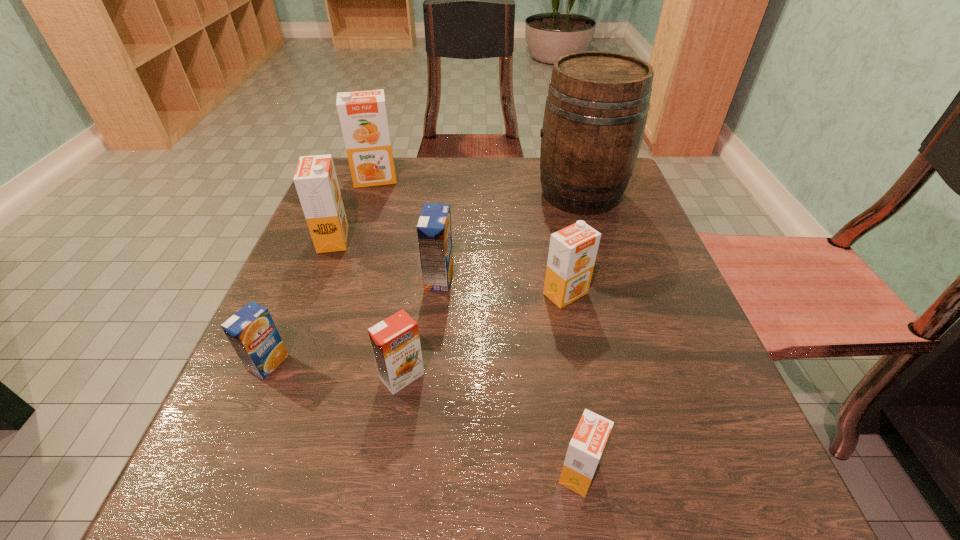
The image size is (960, 540). I want to click on free space located on the right of the third orange orange juice from right to left, so click(x=568, y=376).

At what (x,y) coordinates should I click in order to perform the action: click on vacant space located 0.270m on the back of the nearer blue orange_juice. Please return your answer as a coordinate pair (x, y). This screenshot has height=540, width=960. Looking at the image, I should click on (320, 243).

This screenshot has width=960, height=540. I want to click on vacant point located 0.300m on the left of the nearest object, so click(324, 472).

Image resolution: width=960 pixels, height=540 pixels. In order to click on cider that is positioned at the far edge in this screenshot , I will do `click(596, 109)`.

Where is `orange juice positioned at the far edge`? orange juice positioned at the far edge is located at coordinates (363, 117).

Locate an element on the screen. object located in the near edge section of the desktop is located at coordinates (585, 449).

I want to click on object located in the right edge section of the desktop, so click(x=596, y=109).

Find the location of a particular element. object that is at the far left corner is located at coordinates (363, 117).

Locate an element on the screen. Image resolution: width=960 pixels, height=540 pixels. object that is at the far right corner is located at coordinates (596, 109).

I want to click on vacant space at the far edge of the desktop, so click(x=501, y=159).